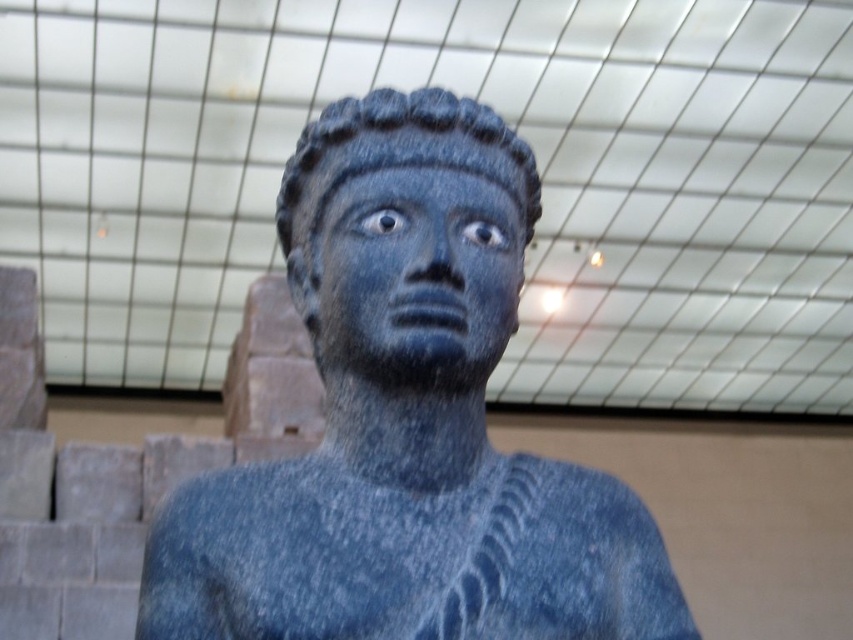
Question: Among these objects, which one is nearest to the camera?

Choices:
 (A) matte stone face at center
 (B) slate stone statue at center

Answer: (A)

Question: Which of the following is the closest to the observer?

Choices:
 (A) (419, 240)
 (B) (451, 387)

Answer: (A)

Question: Is slate stone statue at center positioned before matte stone face at center?

Choices:
 (A) yes
 (B) no

Answer: (B)

Question: Does slate stone statue at center appear under matte stone face at center?

Choices:
 (A) no
 (B) yes

Answer: (A)

Question: Which point is farther to the camera?

Choices:
 (A) (482, 200)
 (B) (486, 221)

Answer: (B)

Question: Is slate stone statue at center wider than matte stone face at center?

Choices:
 (A) yes
 (B) no

Answer: (A)